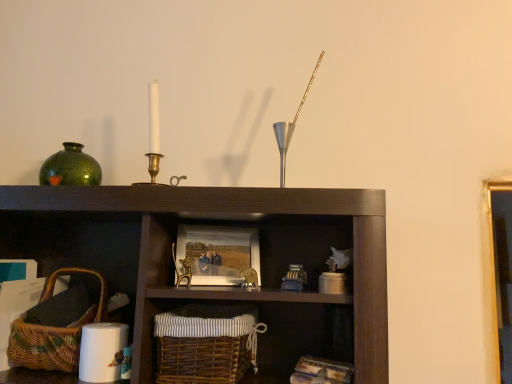
Question: Which direction should I rotate to face woven brown basket at lower center, placed as the 1th basket when sorted from right to left, — up or down?

Choices:
 (A) down
 (B) up

Answer: (A)

Question: From the image's perspective, is green glossy vase at upper left on woven brown basket at lower left, the 1th basket viewed from the left?

Choices:
 (A) no
 (B) yes

Answer: (B)

Question: Could woven brown basket at lower left, which appears as the 2th basket when viewed from the right, be considered to be inside green glossy vase at upper left?

Choices:
 (A) no
 (B) yes

Answer: (A)

Question: Is green glossy vase at upper left at the left side of woven brown basket at lower left, the 1th basket viewed from the left?

Choices:
 (A) no
 (B) yes

Answer: (B)

Question: Can you confirm if green glossy vase at upper left is positioned to the right of woven brown basket at lower left, the 1th basket viewed from the left?

Choices:
 (A) yes
 (B) no

Answer: (B)

Question: Can you confirm if green glossy vase at upper left is thinner than woven brown basket at lower left, which appears as the 2th basket when viewed from the right?

Choices:
 (A) yes
 (B) no

Answer: (A)

Question: From a real-world perspective, is green glossy vase at upper left below woven brown basket at lower left, the 1th basket viewed from the left?

Choices:
 (A) yes
 (B) no

Answer: (B)

Question: Is woven brown basket at lower center, the second basket viewed from the left, oriented towards wooden picture frame at center?

Choices:
 (A) no
 (B) yes

Answer: (A)

Question: Is woven brown basket at lower center, placed as the 1th basket when sorted from right to left, not close to wooden picture frame at center?

Choices:
 (A) no
 (B) yes

Answer: (A)

Question: Considering the relative sizes of woven brown basket at lower center, the second basket viewed from the left, and wooden picture frame at center in the image provided, is woven brown basket at lower center, the second basket viewed from the left, smaller than wooden picture frame at center?

Choices:
 (A) no
 (B) yes

Answer: (A)

Question: Is the depth of woven brown basket at lower center, placed as the 1th basket when sorted from right to left, less than that of wooden picture frame at center?

Choices:
 (A) no
 (B) yes

Answer: (B)

Question: From a real-world perspective, is woven brown basket at lower center, placed as the 1th basket when sorted from right to left, on wooden picture frame at center?

Choices:
 (A) yes
 (B) no

Answer: (B)

Question: From a real-world perspective, is woven brown basket at lower center, the second basket viewed from the left, located beneath wooden picture frame at center?

Choices:
 (A) yes
 (B) no

Answer: (A)

Question: Is woven brown basket at lower left, which appears as the 2th basket when viewed from the right, facing away from green glossy vase at upper left?

Choices:
 (A) no
 (B) yes

Answer: (A)